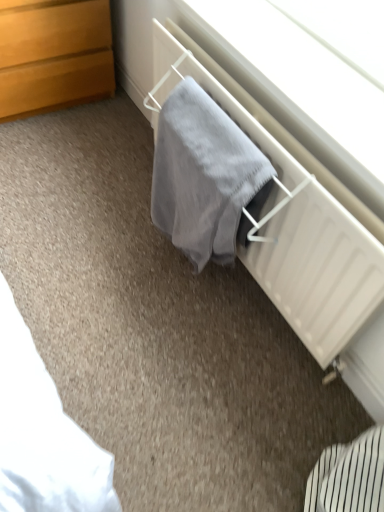
Question: Is gray fabric at center positioned in front of wooden chest of drawers at upper left?

Choices:
 (A) no
 (B) yes

Answer: (B)

Question: Can you confirm if gray fabric at center is thinner than wooden chest of drawers at upper left?

Choices:
 (A) yes
 (B) no

Answer: (A)

Question: Considering the relative sizes of gray fabric at center and wooden chest of drawers at upper left in the image provided, is gray fabric at center bigger than wooden chest of drawers at upper left?

Choices:
 (A) no
 (B) yes

Answer: (A)

Question: From a real-world perspective, does gray fabric at center sit lower than wooden chest of drawers at upper left?

Choices:
 (A) no
 (B) yes

Answer: (A)

Question: Is gray fabric at center at the right side of wooden chest of drawers at upper left?

Choices:
 (A) no
 (B) yes

Answer: (B)

Question: Would you say gray fabric at center is inside or outside wooden chest of drawers at upper left?

Choices:
 (A) inside
 (B) outside

Answer: (B)

Question: Relative to wooden chest of drawers at upper left, is gray fabric at center in front or behind?

Choices:
 (A) behind
 (B) front

Answer: (B)

Question: From the image's perspective, is gray fabric at center above or below wooden chest of drawers at upper left?

Choices:
 (A) below
 (B) above

Answer: (A)

Question: Based on their sizes in the image, would you say gray fabric at center is bigger or smaller than wooden chest of drawers at upper left?

Choices:
 (A) small
 (B) big

Answer: (A)

Question: From a real-world perspective, is gray soft towel at center physically located above or below wooden chest of drawers at upper left?

Choices:
 (A) above
 (B) below

Answer: (A)

Question: Relative to wooden chest of drawers at upper left, is gray soft towel at center in front or behind?

Choices:
 (A) front
 (B) behind

Answer: (A)

Question: Visually, is gray soft towel at center positioned to the left or to the right of wooden chest of drawers at upper left?

Choices:
 (A) right
 (B) left

Answer: (A)

Question: Is gray soft towel at center taller or shorter than wooden chest of drawers at upper left?

Choices:
 (A) tall
 (B) short

Answer: (A)

Question: In the image, is gray soft towel at center positioned in front of or behind gray fabric at center?

Choices:
 (A) behind
 (B) front

Answer: (A)

Question: Looking at their shapes, would you say gray soft towel at center is wider or thinner than gray fabric at center?

Choices:
 (A) thin
 (B) wide

Answer: (A)